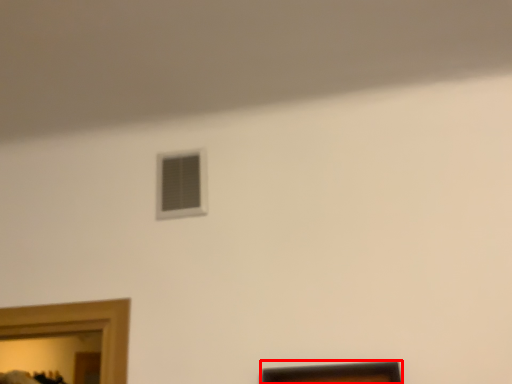
Question: From the image's perspective, considering the relative positions of picture frame (annotated by the red box) and window in the image provided, where is picture frame (annotated by the red box) located with respect to the staircase?

Choices:
 (A) below
 (B) above

Answer: (A)